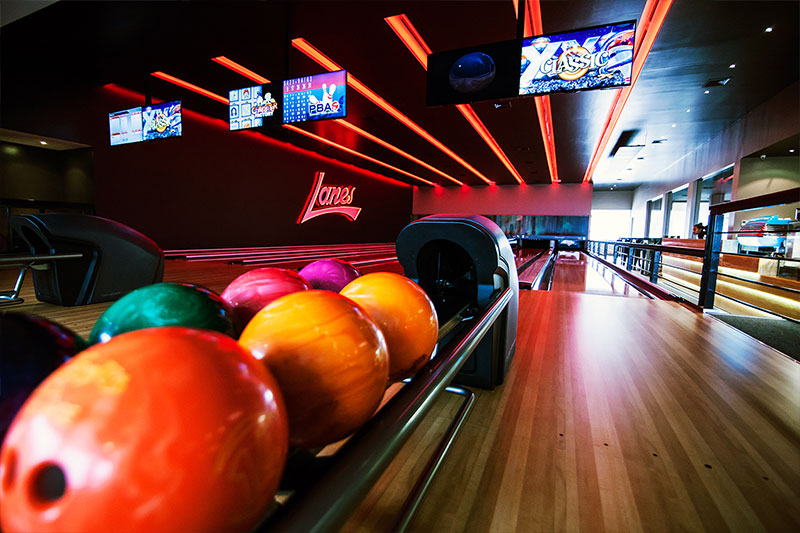
Find the location of a particular element. The height and width of the screenshot is (533, 800). orange strip light on ceiling is located at coordinates (612, 127), (546, 130), (489, 138), (442, 146), (409, 153), (388, 165), (369, 176).